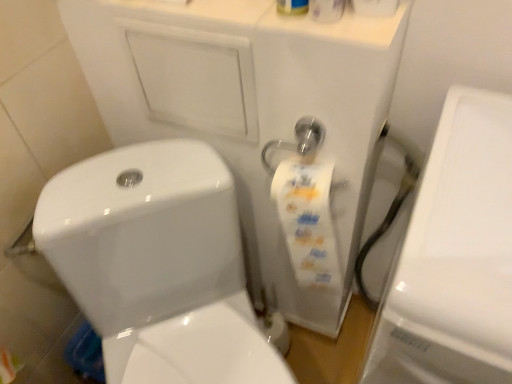
Question: Is white glossy toilet at center in front of or behind white glossy toilet paper at upper center in the image?

Choices:
 (A) front
 (B) behind

Answer: (B)

Question: Is white glossy toilet at center situated inside white glossy toilet paper at upper center or outside?

Choices:
 (A) inside
 (B) outside

Answer: (B)

Question: Which of these objects is positioned farthest from the white glossy porcelain at right?

Choices:
 (A) white glossy toilet at center
 (B) white glossy toilet paper at upper center

Answer: (A)

Question: Which is nearer to the white glossy toilet at center?

Choices:
 (A) white glossy toilet paper at upper center
 (B) white glossy porcelain at right

Answer: (B)